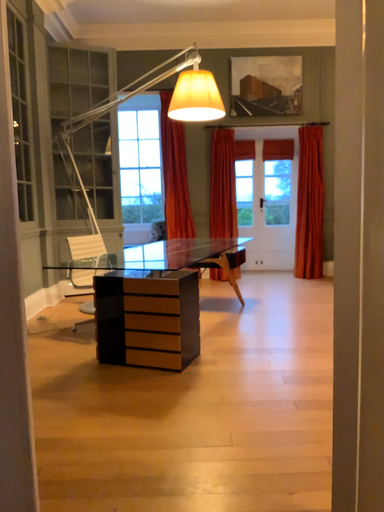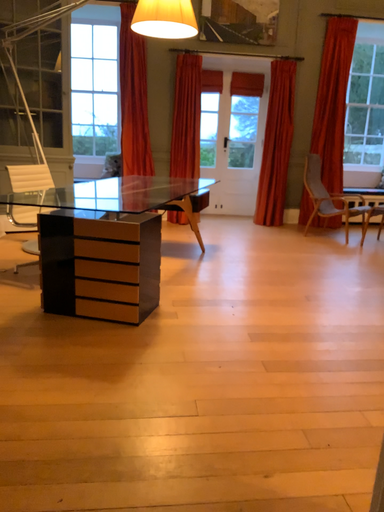
Question: How did the camera likely rotate when shooting the video?

Choices:
 (A) rotated left
 (B) rotated right

Answer: (B)